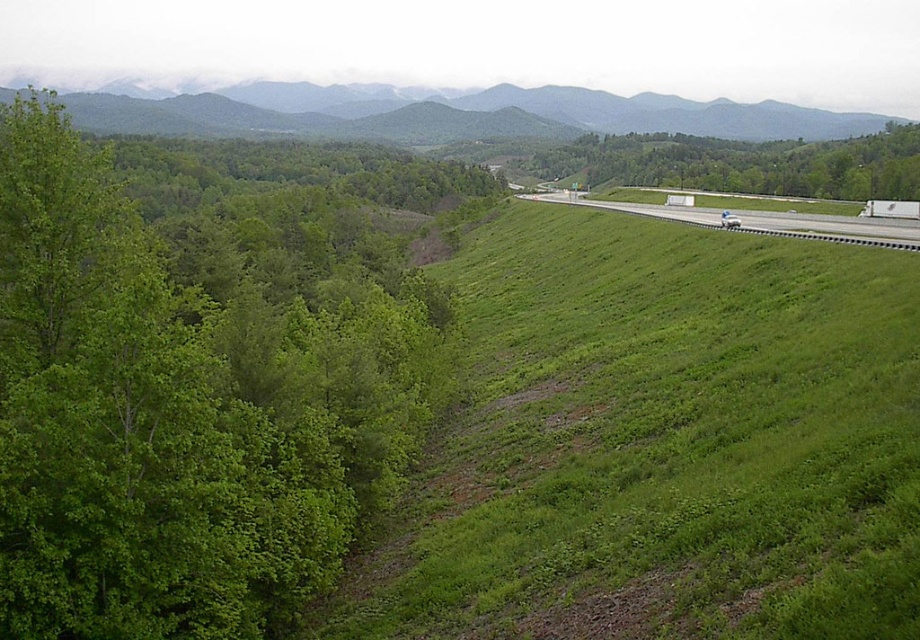
You are a hiker standing at the base of the green grassy hillside at upper center and want to reach the green leafy tree at left. Which direction should you move to get there?

The green leafy tree at left is below the green grassy hillside at upper center, so you should move downward to reach it.

Looking at this image, you are a bird flying over the green leafy tree at center and the white asphalt highway at right. Which object would you need to fly higher to avoid hitting?

The green leafy tree at center is much taller than the white asphalt highway at right, so you would need to fly higher to avoid hitting the green leafy tree at center.

Based on the scene description, where is the green grassy hillside at upper center located in terms of its 2D coordinates?

The green grassy hillside at upper center is located at the 2D coordinates point (x=458, y=115).